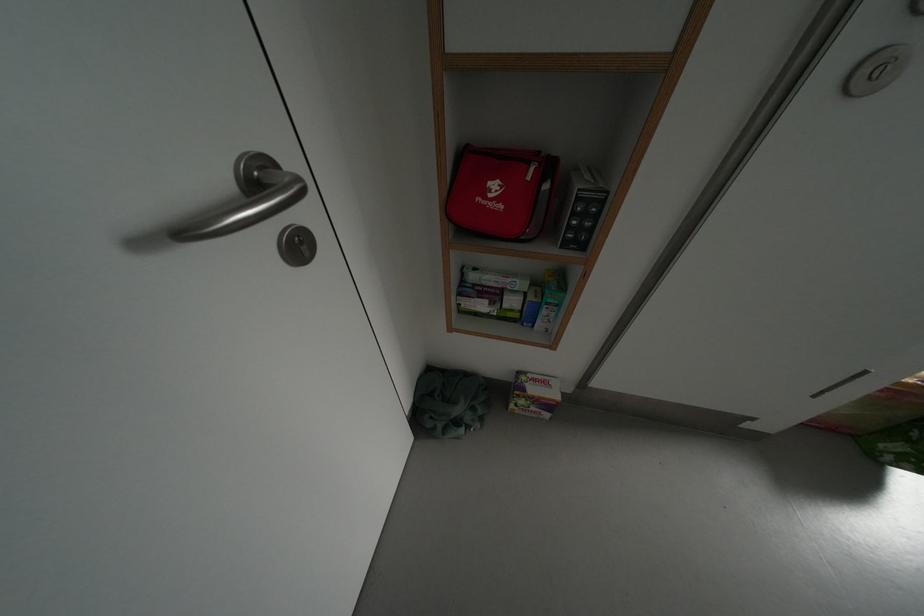
What do you see at coordinates (246, 200) in the screenshot?
I see `the metal door handle` at bounding box center [246, 200].